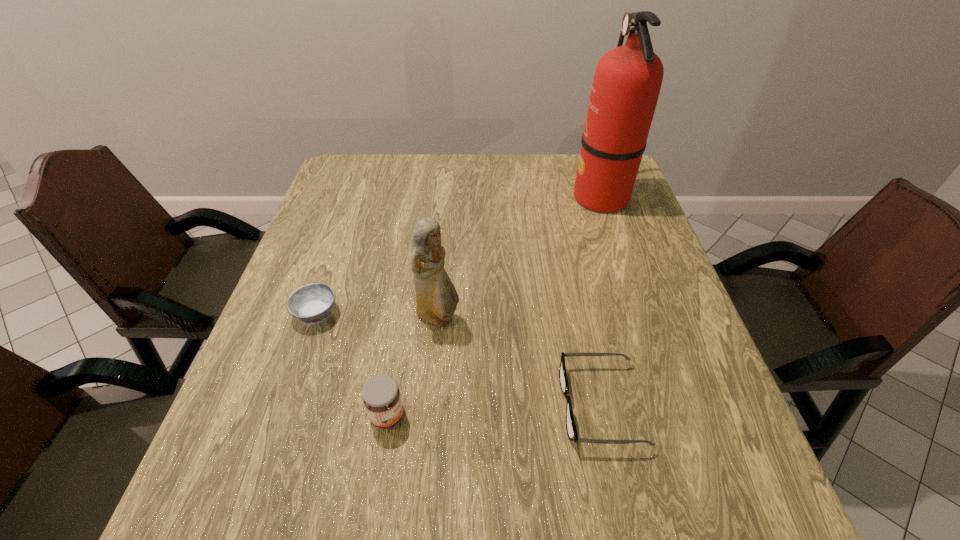
Image resolution: width=960 pixels, height=540 pixels. I want to click on free space located on the front of the third shortest object, so click(380, 461).

At what (x,y) coordinates should I click in order to perform the action: click on free space located on the front-facing side of the spectacles. Please return your answer as a coordinate pair (x, y). This screenshot has width=960, height=540. Looking at the image, I should click on (360, 405).

This screenshot has width=960, height=540. I want to click on vacant space situated 0.090m on the front-facing side of the spectacles, so click(513, 405).

This screenshot has width=960, height=540. I want to click on vacant area situated 0.080m on the front-facing side of the spectacles, so click(x=517, y=405).

What are the coordinates of `free space located on the front of the ashtray` in the screenshot? It's located at (290, 390).

At what (x,y) coordinates should I click in order to perform the action: click on object positioned at the far edge. Please return your answer as a coordinate pair (x, y). Looking at the image, I should click on (627, 81).

Where is `object situated at the left edge`? object situated at the left edge is located at coordinates [x=312, y=303].

Find the location of `fire extinguisher present at the right edge`. fire extinguisher present at the right edge is located at coordinates (627, 81).

Find the location of a particular element. The height and width of the screenshot is (540, 960). spectacles at the right edge is located at coordinates (570, 424).

At what (x,y) coordinates should I click in order to perform the action: click on object that is at the far right corner. Please return your answer as a coordinate pair (x, y). This screenshot has height=540, width=960. Looking at the image, I should click on (627, 81).